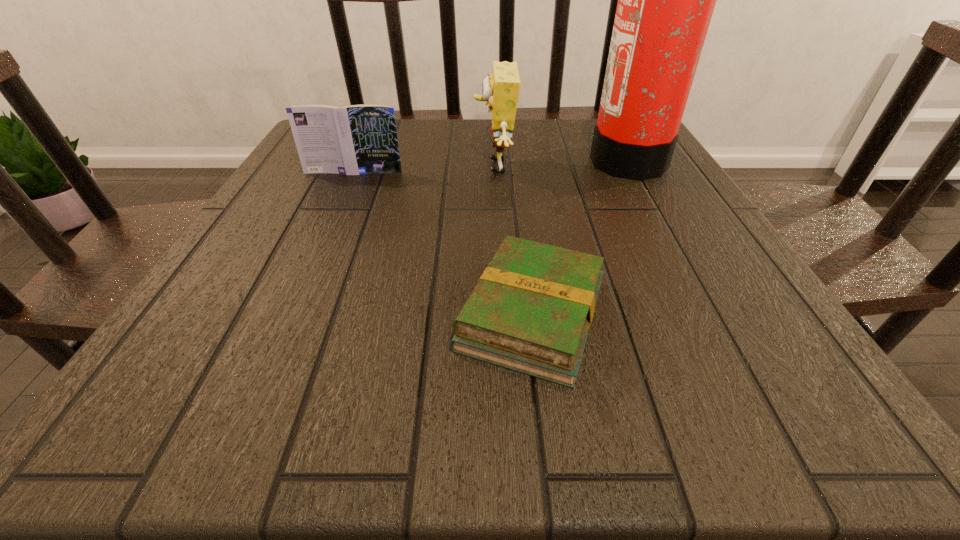
Find the location of `object that is at the far right corner`. object that is at the far right corner is located at coordinates (666, 0).

In the image, there is a desktop. Find the location of `vacant space at the far edge`. vacant space at the far edge is located at coordinates (444, 124).

Image resolution: width=960 pixels, height=540 pixels. In the image, there is a desktop. Identify the location of vacant space at the near edge. (682, 402).

In the image, there is a desktop. Find the location of `blank space at the right edge`. blank space at the right edge is located at coordinates (740, 282).

Image resolution: width=960 pixels, height=540 pixels. Identify the location of free region at the near left corner. (149, 428).

You are a GUI agent. You are given a task and a screenshot of the screen. Output one action in this format:
    pyautogui.click(x=<x>, y=<y>)
    Task: Click on the free space between the farther book and the fire extinguisher
    The image size is (960, 540).
    Given the screenshot: What is the action you would take?
    pyautogui.click(x=491, y=165)

Image resolution: width=960 pixels, height=540 pixels. What are the coordinates of `free point between the left book and the rightmost object` in the screenshot? It's located at (491, 165).

This screenshot has width=960, height=540. I want to click on free area in between the farther book and the rightmost object, so (x=491, y=165).

Image resolution: width=960 pixels, height=540 pixels. I want to click on vacant space that is in between the fire extinguisher and the second tallest object, so click(x=561, y=163).

I want to click on free area in between the tallest object and the leftmost object, so pyautogui.click(x=491, y=165).